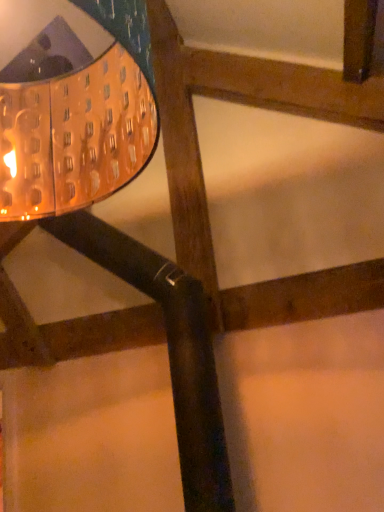
What is the approximate width of copper textured lampshade at upper left?

copper textured lampshade at upper left is 21.06 inches wide.

The height and width of the screenshot is (512, 384). What are the coordinates of `copper textured lampshade at upper left` in the screenshot? It's located at (73, 106).

What do you see at coordinates (73, 106) in the screenshot?
I see `copper textured lampshade at upper left` at bounding box center [73, 106].

At what (x,y) coordinates should I click in order to perform the action: click on copper textured lampshade at upper left. Please return your answer as a coordinate pair (x, y). Looking at the image, I should click on (73, 106).